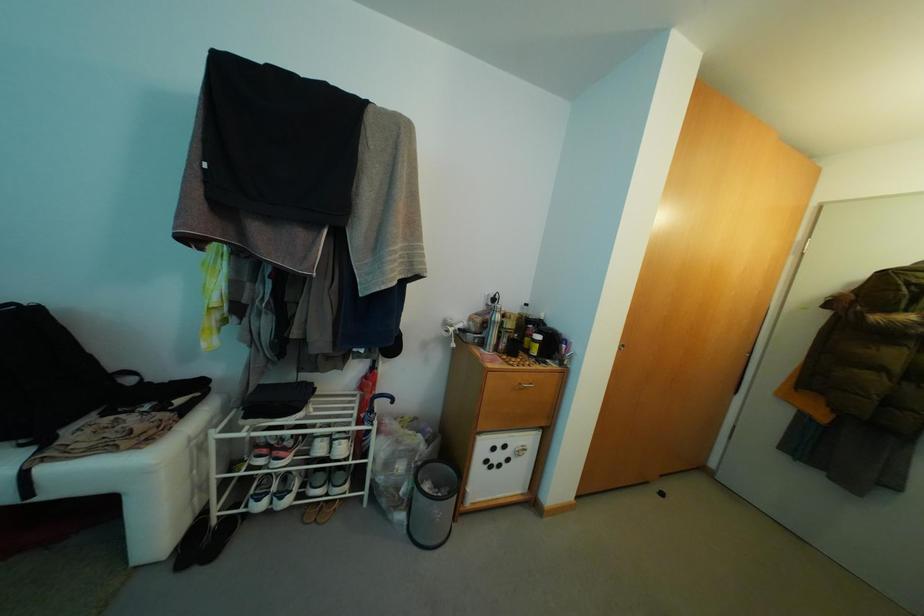
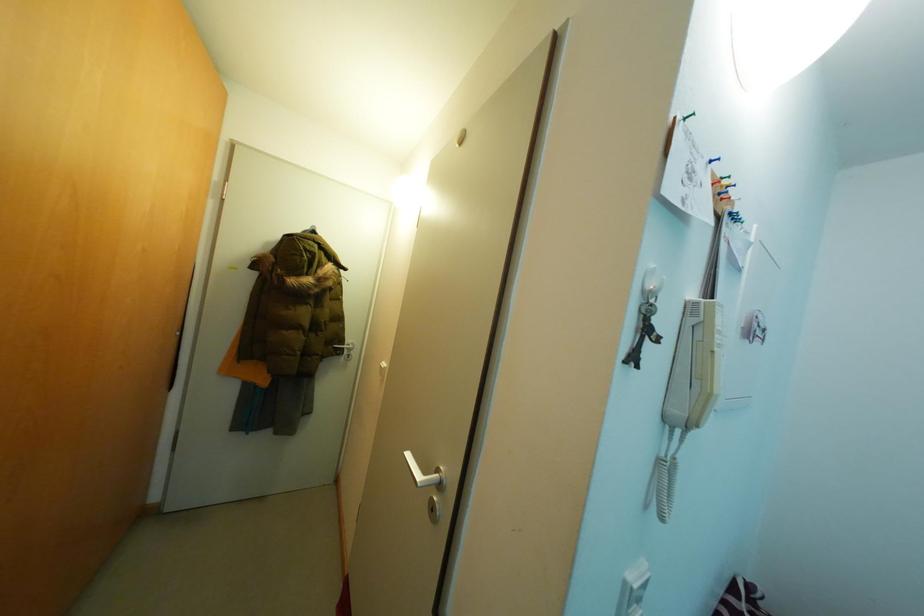
Question: The camera is either moving clockwise (left) or counter-clockwise (right) around the object. The first image is from the beginning of the video and the second image is from the end. Is the camera moving left or right when shooting the video?

Choices:
 (A) Left
 (B) Right

Answer: (A)